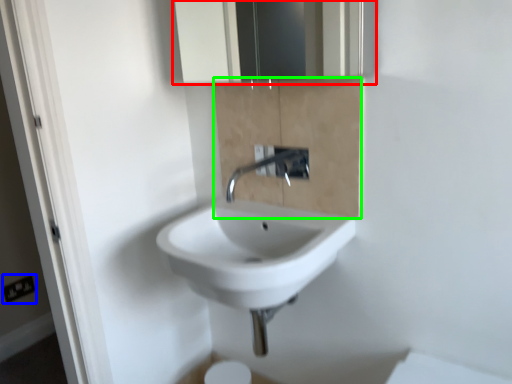
Question: Which object is positioned farthest from medicine cabinet (highlighted by a red box)? Select from electric outlet (highlighted by a blue box) and cabinetry (highlighted by a green box).

Choices:
 (A) electric outlet
 (B) cabinetry

Answer: (A)